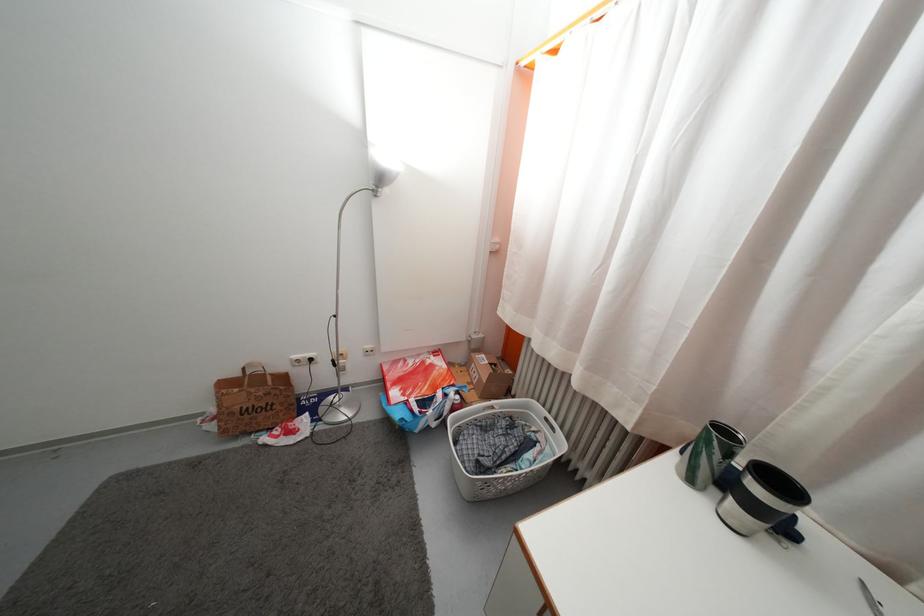
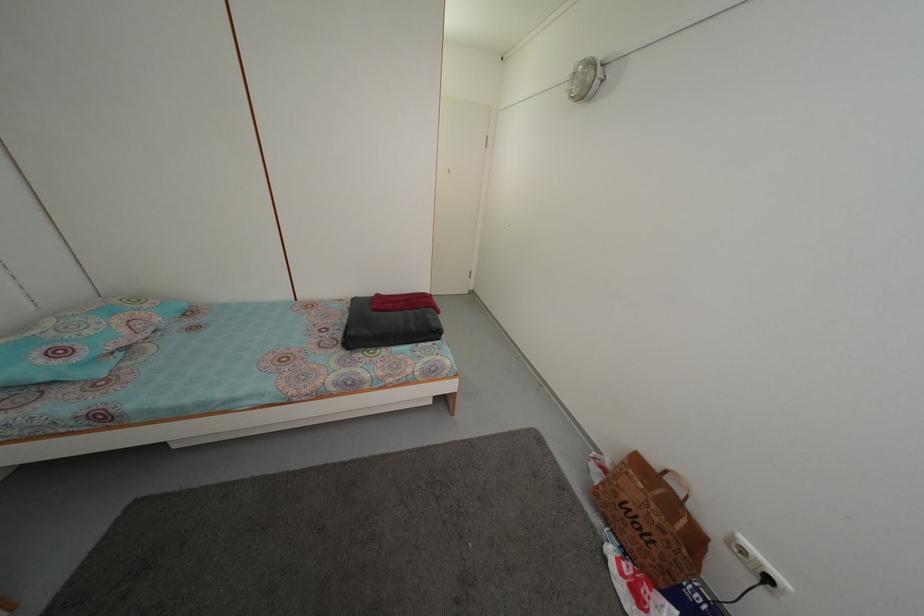
The point at [317,367] is marked in the first image. Where is the corresponding point in the second image?

(774, 588)